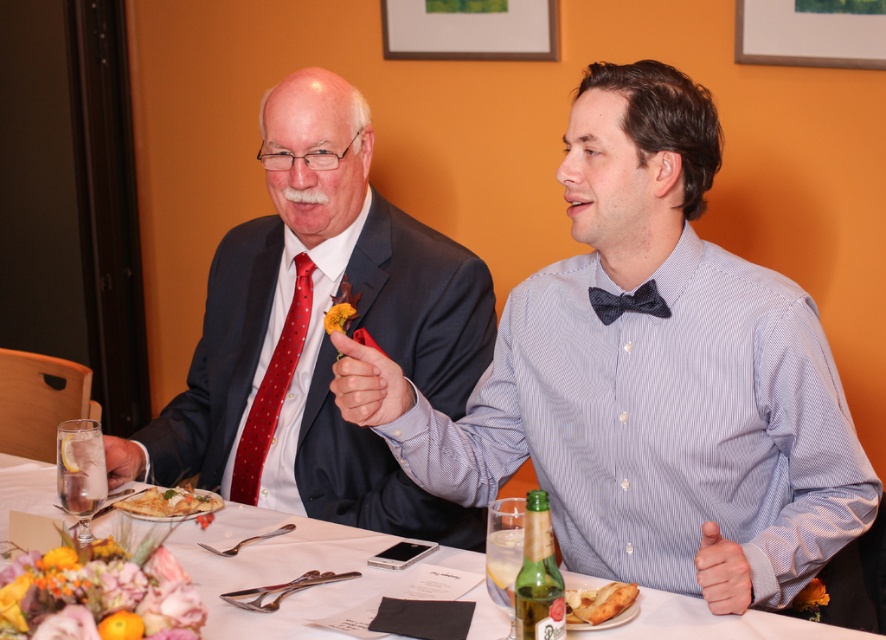
Question: Which point is closer to the camera taking this photo?

Choices:
 (A) (351, 449)
 (B) (737, 564)
 (C) (142, 458)
 (D) (270, 406)

Answer: (B)

Question: Which point is closer to the camera taking this photo?

Choices:
 (A) (702, 589)
 (B) (134, 449)
 (C) (140, 515)

Answer: (A)

Question: Can you confirm if matte black suit at left is positioned to the right of matte red tie at center?

Choices:
 (A) yes
 (B) no

Answer: (B)

Question: Is red dotted tie at left further to camera compared to clear glass at upper left?

Choices:
 (A) yes
 (B) no

Answer: (A)

Question: Which object is the farthest from the dark blue textured bow tie at center?

Choices:
 (A) clear glass at upper left
 (B) matte black suit at left
 (C) red dotted tie at left

Answer: (A)

Question: Observing the image, what is the correct spatial positioning of matte black suit at left in reference to red dotted tie at left?

Choices:
 (A) left
 (B) right

Answer: (B)